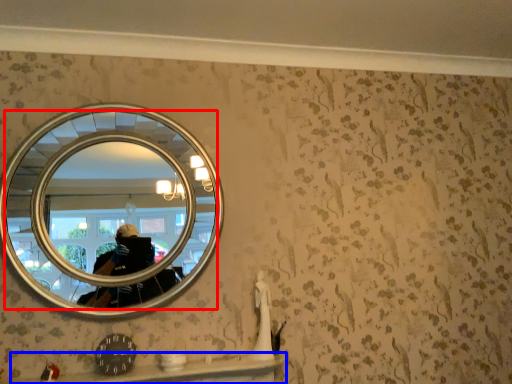
Question: Which point is further to the camera, mirror (highlighted by a red box) or ledge (highlighted by a blue box)?

Choices:
 (A) mirror
 (B) ledge

Answer: (A)